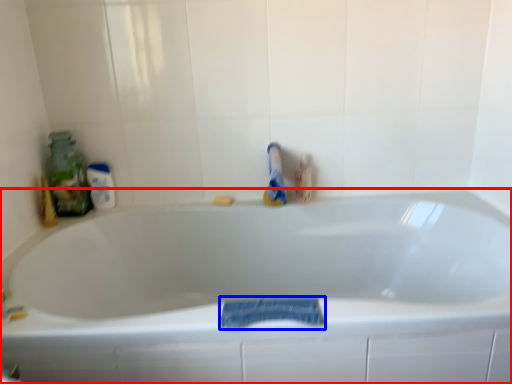
Question: Which of the following is the closest to the observer, bathtub (highlighted by a red box) or bath towel (highlighted by a blue box)?

Choices:
 (A) bathtub
 (B) bath towel

Answer: (A)